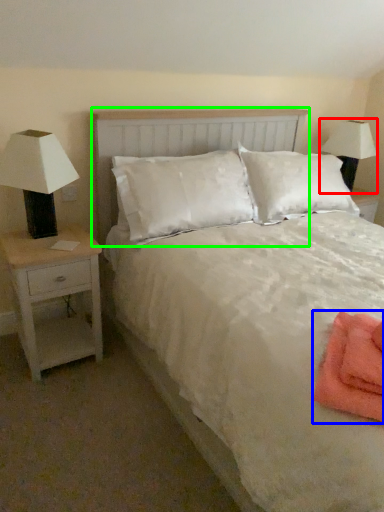
Question: Considering the real-world distances, which object is farthest from lamp (highlighted by a red box)? material (highlighted by a blue box) or headboard (highlighted by a green box)?

Choices:
 (A) material
 (B) headboard

Answer: (A)